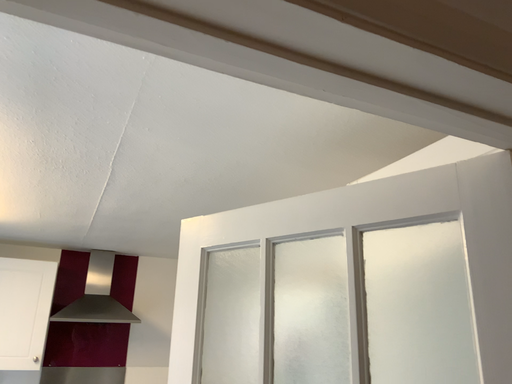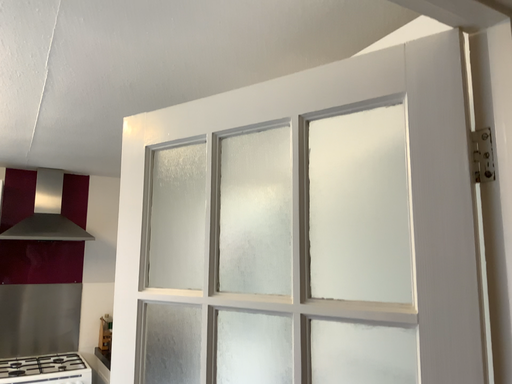
Question: How did the camera likely rotate when shooting the video?

Choices:
 (A) rotated upward
 (B) rotated downward

Answer: (B)